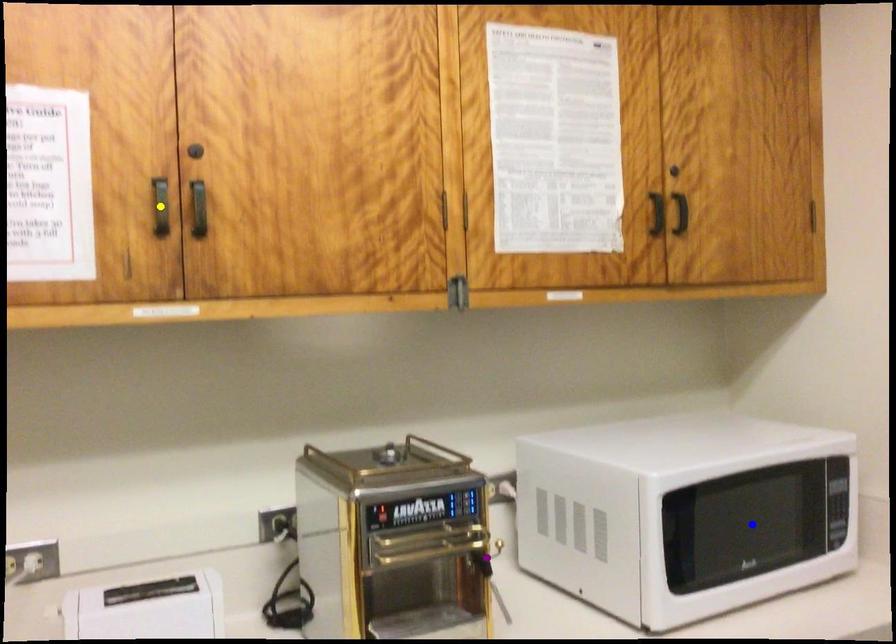
Order these from nearest to farthest:
A) yellow point
B) purple point
C) blue point

yellow point → blue point → purple point